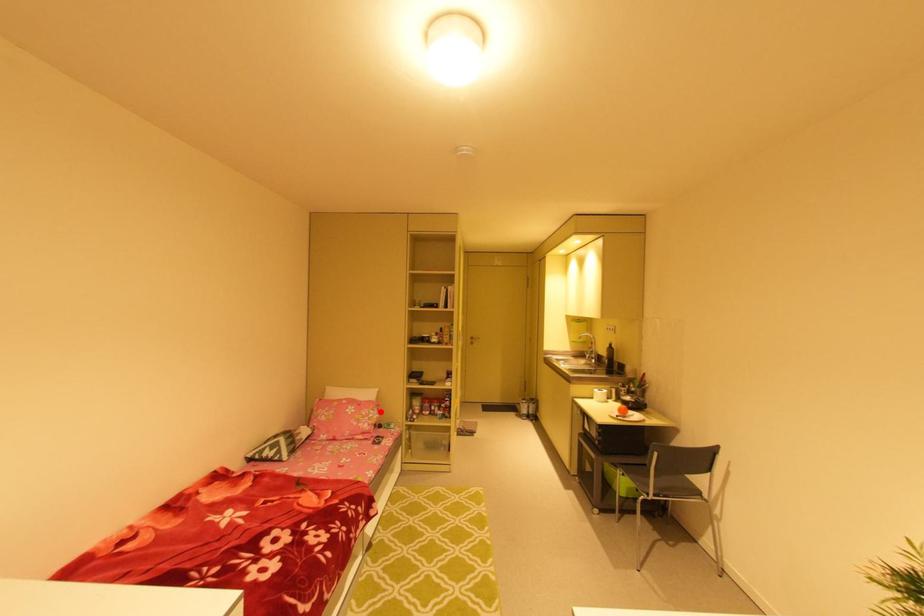
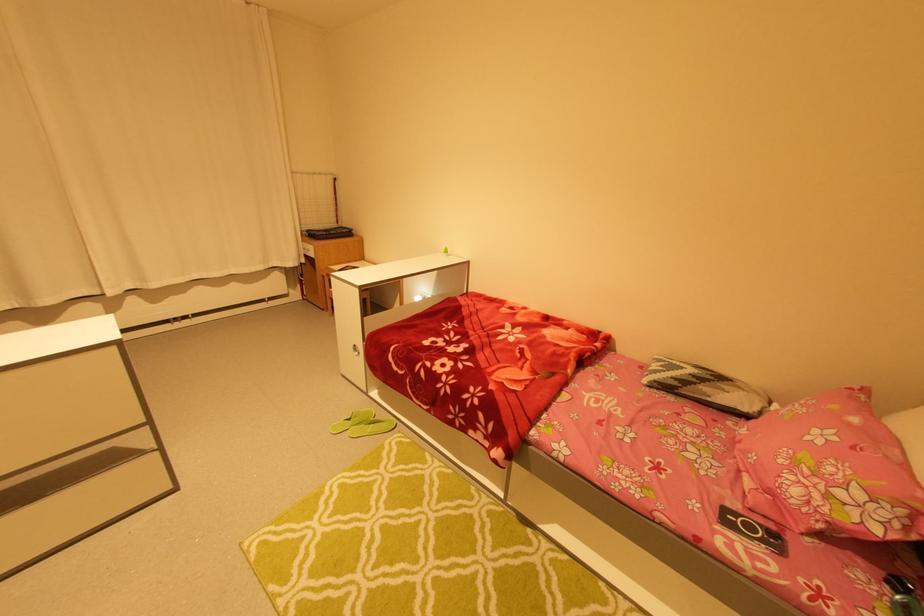
Find the pixel in the second image that matches the highlighted location in the first image.

(891, 515)